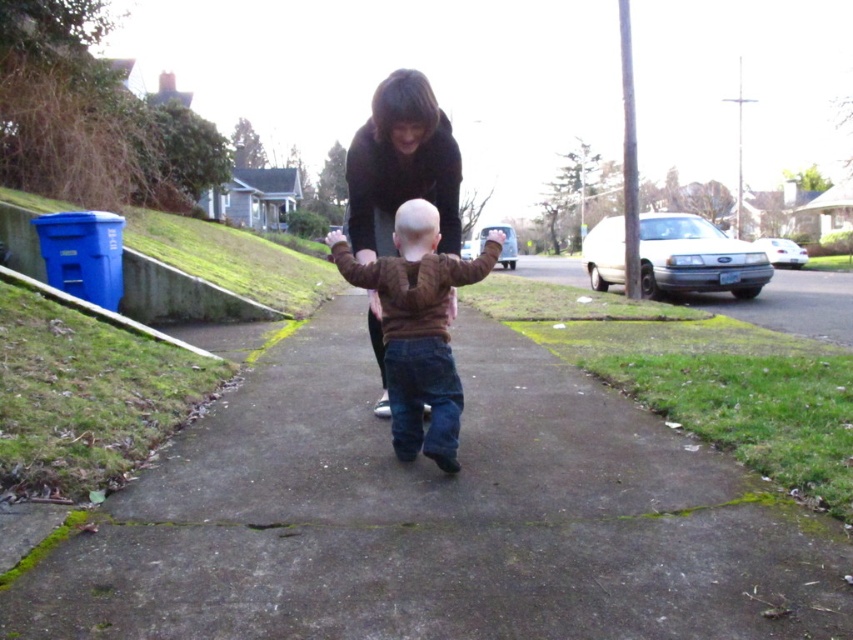
You are standing on the residential street and want to place a small potted plant between the concrete at center and the dark brown sweater at center. Considering their heights, which object should the potted plant be placed on top of?

The concrete at center has a greater height compared to dark brown sweater at center, so the potted plant should be placed on top of the concrete at center.

You are a delivery person trying to place a package on the concrete at center and the brown fuzzy sweater at center. Which surface is more suitable for placing the package?

The concrete at center is more suitable because it has a larger size compared to the brown fuzzy sweater at center, providing a stable and flat surface for the package.